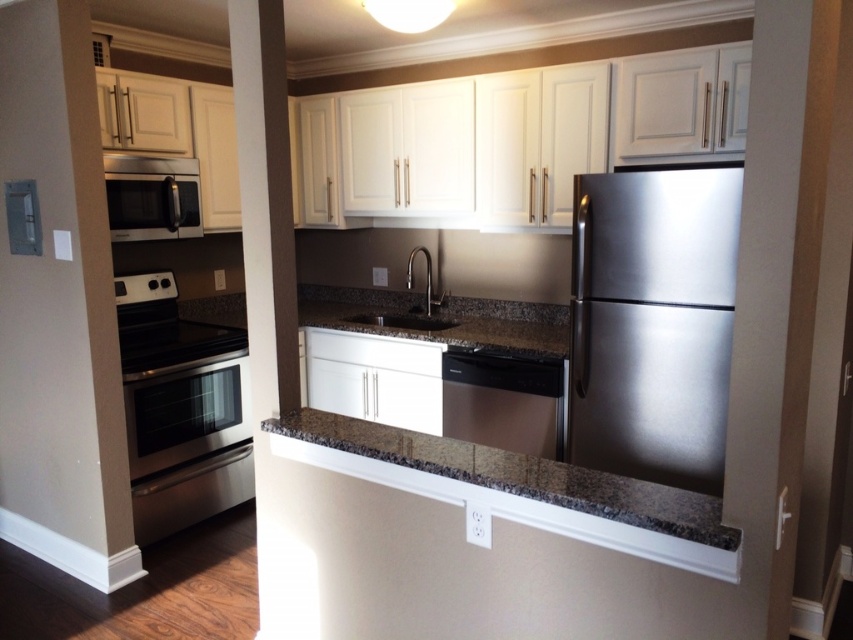
You are standing in the kitchen and want to reach the point at coordinates point [662,502]. If your arm can extend 4 feet, can you reach it without moving?

The point [662,502] is 4.84 feet away from you, which is beyond the 4 feet reach of your arm. Therefore, you cannot reach it without moving.

You are standing in the kitchen and want to reach both points. Which point, point (646, 180) or point (172, 236), is closer to you?

Point (646, 180) is closer to the viewer than point (172, 236).

You are planning to install a new appliance in your kitchen. You have a space that can accommodate the size of the satin stainless steel dishwasher at center. Can the stainless steel oven at left fit in that space?

The stainless steel oven at left has a larger size compared to the satin stainless steel dishwasher at center. Therefore, the oven cannot fit in the space designated for the dishwasher.